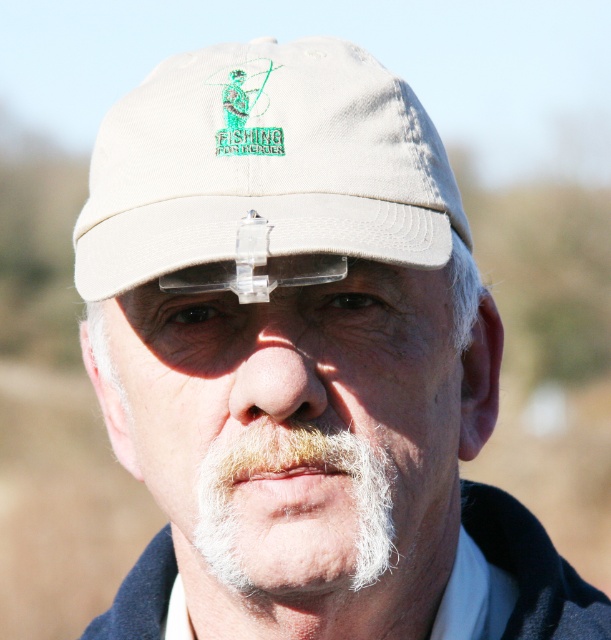
Based on the scene description, can you determine which object occupies more space in the image between the beige fabric baseball cap at center and the white fuzzy beard at lower center?

The beige fabric baseball cap at center is larger in size than the white fuzzy beard at lower center, so it occupies more space in the image.

Based on the photo, based on the scene description, can you determine which object is taller between the beige fabric baseball cap at center and the white fuzzy beard at lower center?

The beige fabric baseball cap at center is much taller than the white fuzzy beard at lower center according to the description.